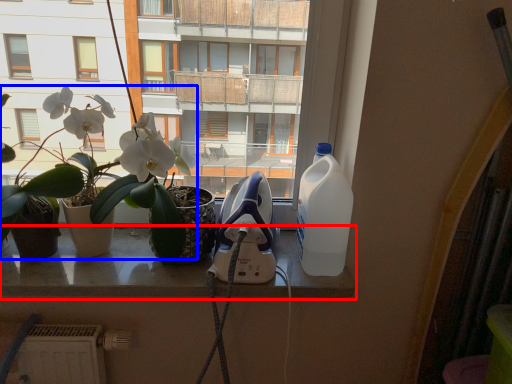
Question: Which point is further to the camera, window (highlighted by a red box) or houseplant (highlighted by a blue box)?

Choices:
 (A) window
 (B) houseplant

Answer: (A)